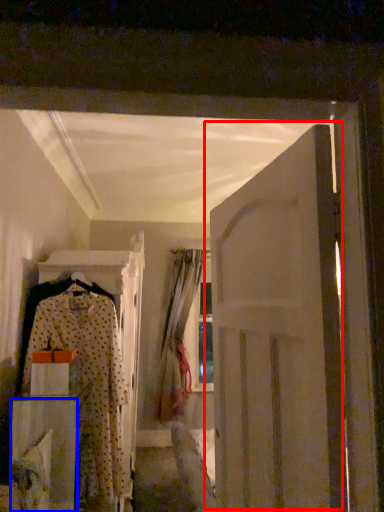
Question: Which object is further to the camera taking this photo, door (highlighted by a red box) or furniture (highlighted by a blue box)?

Choices:
 (A) door
 (B) furniture

Answer: (B)